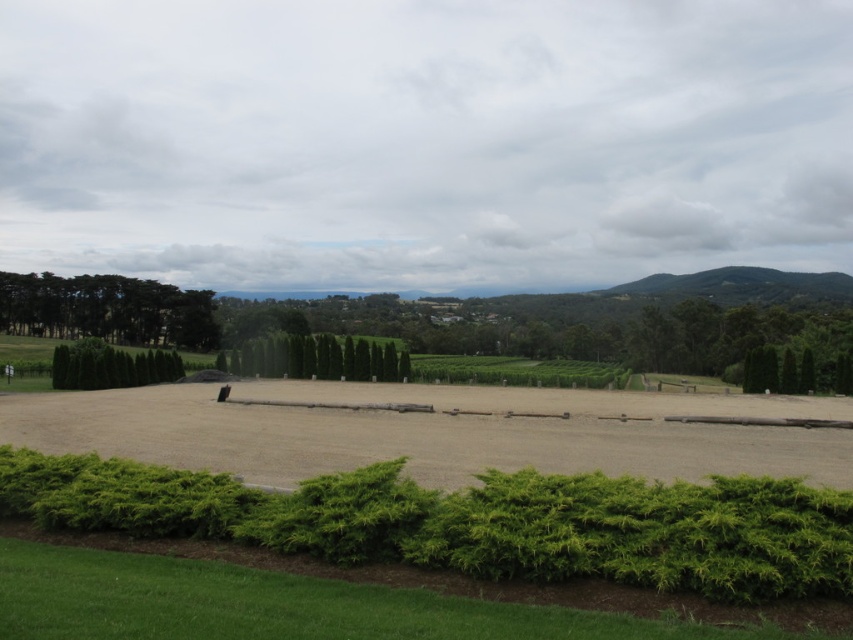
You are planning to plant a row of flowers between the green textured hedge at center and the green leafy hedge at left. Which hedge has a wider space to accommodate the flowers?

The green textured hedge at center has a wider space than the green leafy hedge at left, so it can accommodate the flowers better.

You are standing at the point marked as point (x=108, y=308) in the image. What is the nearest object to you in the scene?

The nearest object to you is the green leafy trees at upper left because the point is located on them.

You are a landscape architect planning to install a new pathway between the green leafy trees at upper left and the green textured hedge at center. Considering their heights, which object might cast a longer shadow in the afternoon sun, potentially affecting the pathway design?

The green leafy trees at upper left has a greater height compared to the green textured hedge at center, so they would cast a longer shadow, which might affect the pathway design.